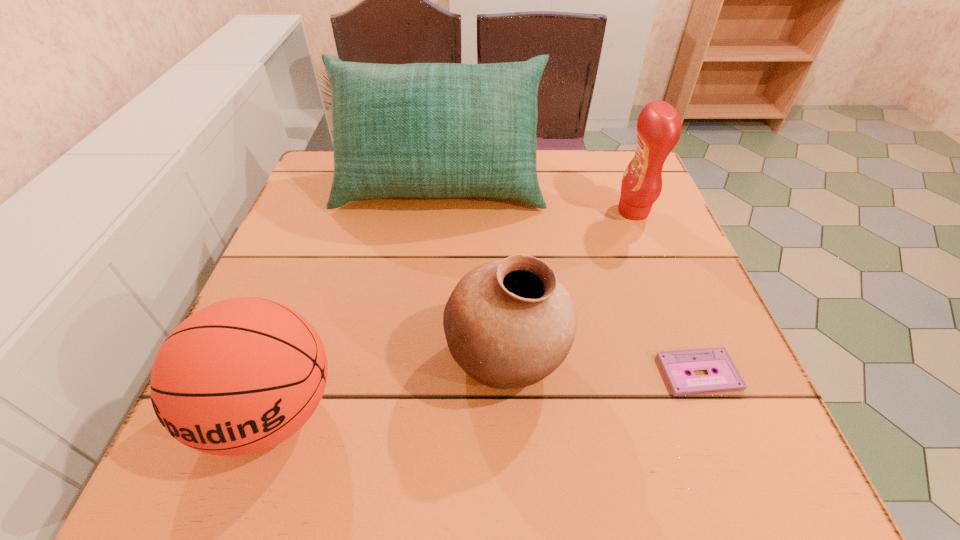
Where is `object that is at the far right corner`? This screenshot has width=960, height=540. object that is at the far right corner is located at coordinates (659, 127).

In the image, there is a desktop. At what (x,y) coordinates should I click in order to perform the action: click on free region at the far edge. Please return your answer as a coordinate pair (x, y). The width and height of the screenshot is (960, 540). Looking at the image, I should click on (579, 168).

What are the coordinates of `free region at the near edge of the desktop` in the screenshot? It's located at (311, 476).

I want to click on vacant space at the left edge of the desktop, so click(322, 222).

At what (x,y) coordinates should I click in order to perform the action: click on free space at the right edge. Please return your answer as a coordinate pair (x, y). Looking at the image, I should click on (738, 413).

This screenshot has width=960, height=540. I want to click on free space at the far left corner, so click(327, 195).

In the image, there is a desktop. Where is `vacant space at the far right corner`? The width and height of the screenshot is (960, 540). vacant space at the far right corner is located at coordinates (617, 166).

Identify the location of unoccupied position between the basketball and the pottery. The image size is (960, 540). (389, 386).

The width and height of the screenshot is (960, 540). Identify the location of vacant space in between the cushion and the videotape. (569, 280).

The width and height of the screenshot is (960, 540). I want to click on empty space between the condiment and the pottery, so click(569, 286).